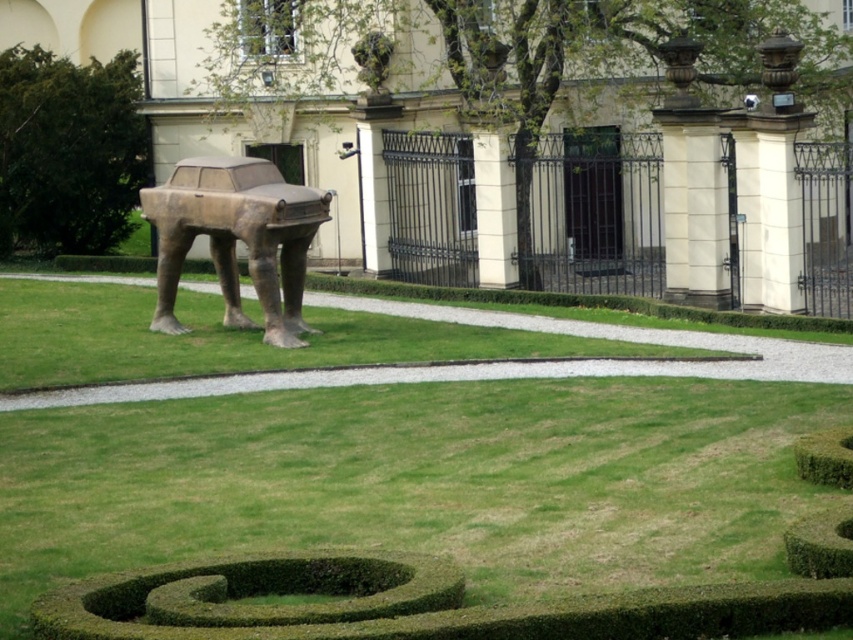
At what (x,y) coordinates should I click in order to perform the action: click on green grass at center. Please return your answer as a coordinate pair (x, y). The image size is (853, 640). Looking at the image, I should click on (389, 481).

Does green grass at center appear on the left side of bronze statue at center?

No, green grass at center is not to the left of bronze statue at center.

This screenshot has height=640, width=853. I want to click on green grass at center, so click(x=389, y=481).

Is green grass at center smaller than green leafy hedge at center?

Incorrect, green grass at center is not smaller in size than green leafy hedge at center.

Locate an element on the screen. The height and width of the screenshot is (640, 853). green grass at center is located at coordinates (389, 481).

Who is positioned more to the right, green leafy hedge at center or bronze statue at center?

Positioned to the right is bronze statue at center.

Who is more forward, (57, 96) or (149, 198)?

Positioned in front is point (149, 198).

Based on the photo, who is more distant from viewer, (4, 148) or (289, 218)?

Positioned behind is point (4, 148).

In order to click on green leafy hedge at center in this screenshot , I will do `click(68, 150)`.